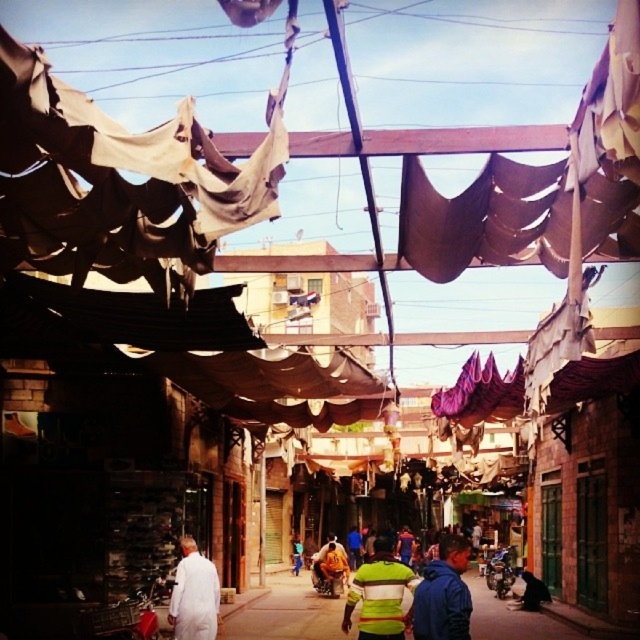
You are standing at the point with coordinates point (x=298, y=563) and want to walk to the point with coordinates point (x=422, y=577). Which direction should you move in to reach your destination?

You should move forward because point (x=422, y=577) is in front of point (x=298, y=563).